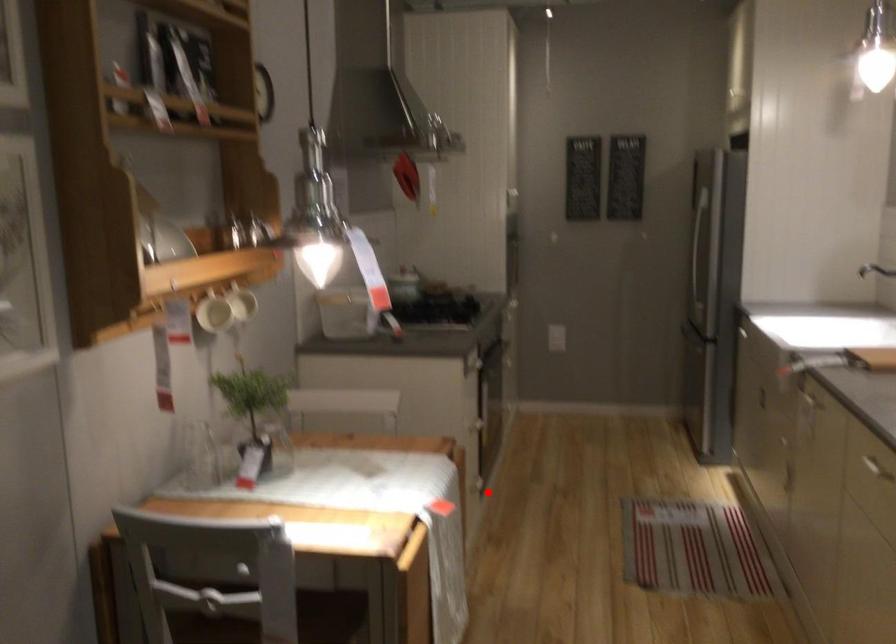
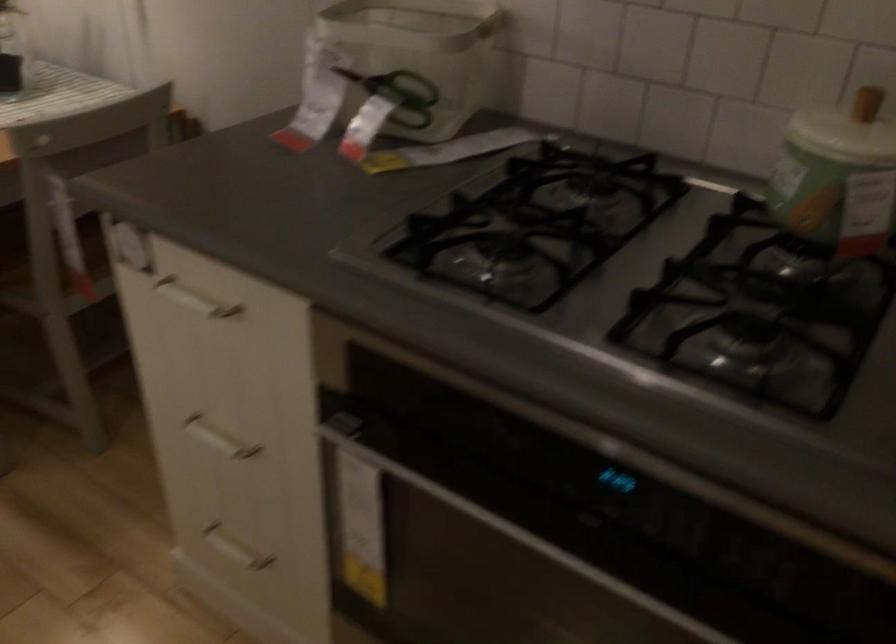
Question: A red point is marked in image1. In image2, is the corresponding 3D point closer to the camera or farther? Reply with the corresponding letter.

Choices:
 (A) The corresponding 3D point is closer.
 (B) The corresponding 3D point is farther.

Answer: (A)